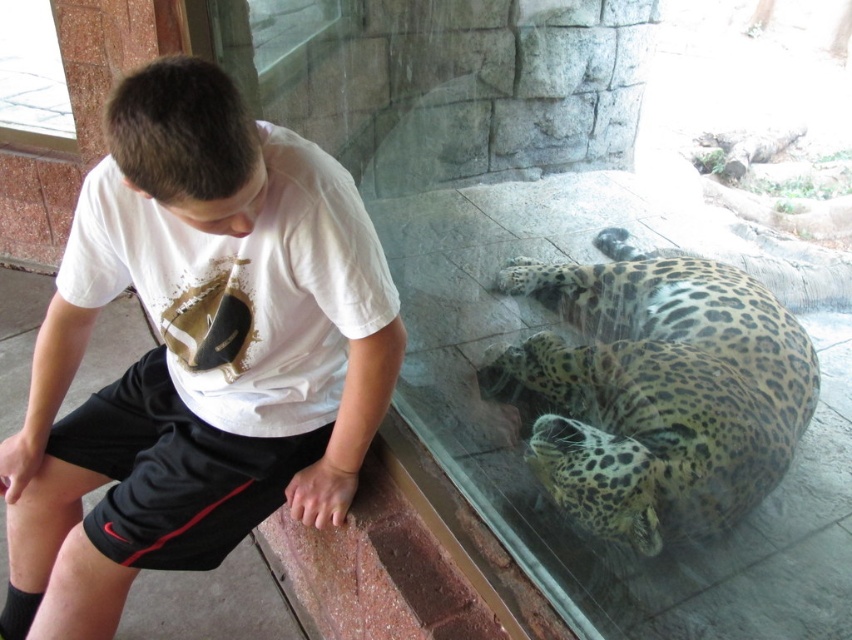
You are a zookeeper tasked with ensuring safety between visitors and animals. You notice the white cotton shirt at center and the spotted fur leopard at lower right. Based on their widths, which one is narrower?

The white cotton shirt at center is narrower than the spotted fur leopard at lower right.

You are a zookeeper observing the scene. You notice the white cotton shirt at center and the spotted fur leopard at lower right. Based on their positions, which object is closer to the ground?

The white cotton shirt at center is below the spotted fur leopard at lower right, so the white cotton shirt at center is closer to the ground.